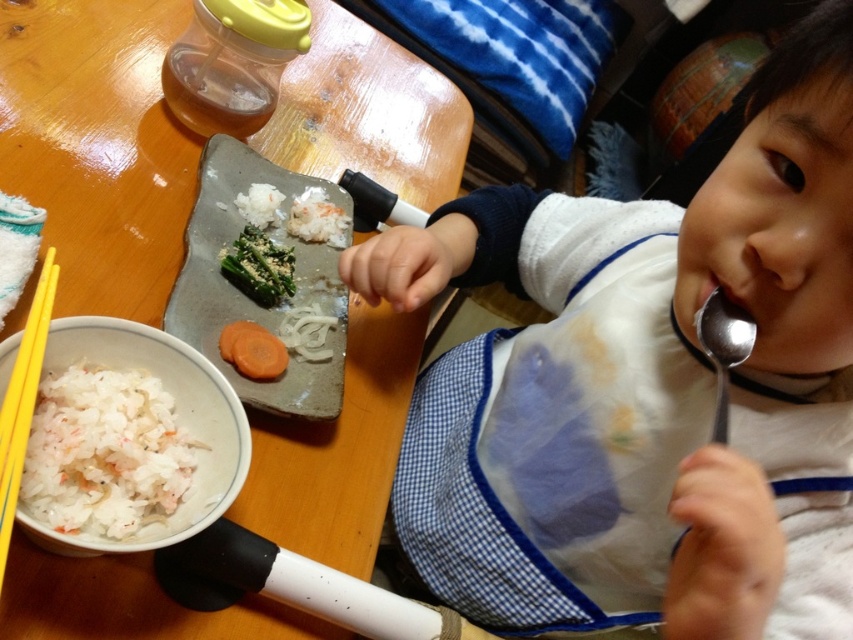
What is located at the coordinates point [646,387] in the image?

The point [646,387] corresponds to the white fabric bib at center.

You are a parent preparing to feed your child. You see the white fabric bib at center and the satin silver spoon at mouth on the table. Which item is located to the left when viewed from the child facing the spoon?

The white fabric bib at center is positioned on the left side of the satin silver spoon at mouth, so when the child faces the spoon, the white fabric bib at center would be to their left.

You are a child sitting at the wooden table and want to grab the white rice at lower left using the yellow plastic chopsticks at lower left. Can you reach the rice with the chopsticks?

The white rice at lower left is to the right of yellow plastic chopsticks at lower left, so yes, the child can reach the rice with the chopsticks since they are positioned to the left of the rice.